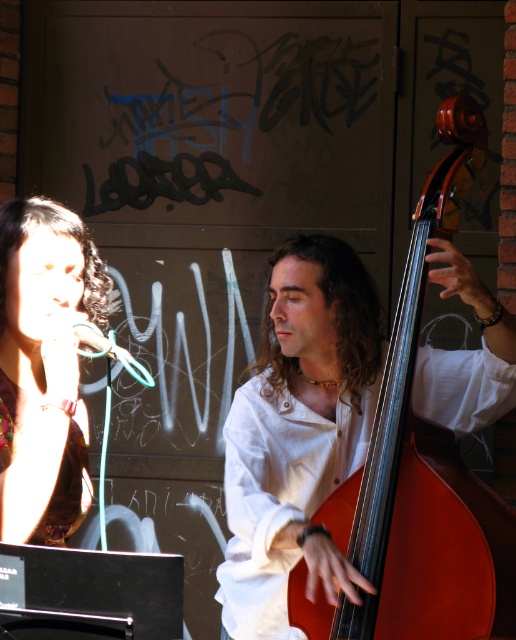
Is shiny brown wood cello at right to the left of matte brown hair at upper left from the viewer's perspective?

No, shiny brown wood cello at right is not to the left of matte brown hair at upper left.

Is shiny brown wood cello at right taller than matte brown hair at upper left?

Correct, shiny brown wood cello at right is much taller as matte brown hair at upper left.

Between point (426, 435) and point (83, 268), which one is positioned behind?

Positioned behind is point (426, 435).

Locate an element on the screen. This screenshot has width=516, height=640. shiny brown wood cello at right is located at coordinates (418, 472).